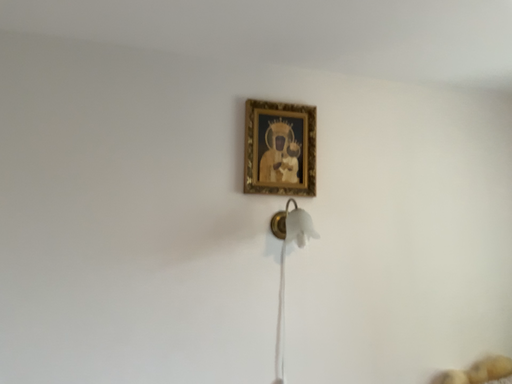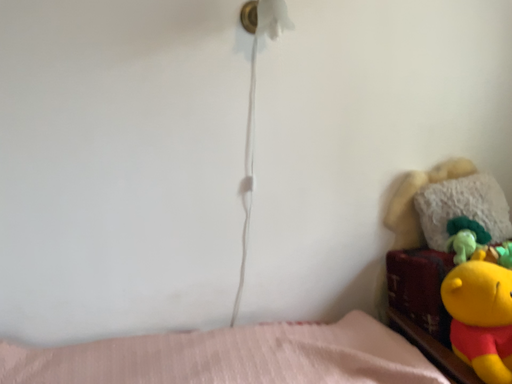
Question: How did the camera likely rotate when shooting the video?

Choices:
 (A) rotated downward
 (B) rotated upward

Answer: (A)